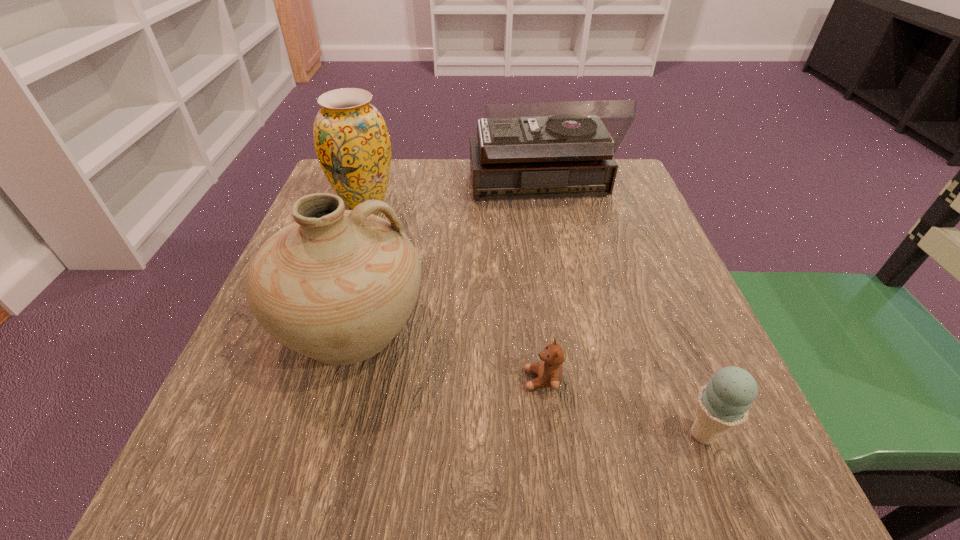
Identify the location of object positioned at the far left corner. This screenshot has height=540, width=960. (351, 140).

Locate an element on the screen. This screenshot has width=960, height=540. object that is at the far right corner is located at coordinates (531, 149).

Locate an element on the screen. This screenshot has height=540, width=960. object that is at the near right corner is located at coordinates (724, 403).

The image size is (960, 540). I want to click on free space at the far edge of the desktop, so click(452, 192).

Where is `vacant space at the near edge of the desktop`? The width and height of the screenshot is (960, 540). vacant space at the near edge of the desktop is located at coordinates (387, 449).

Image resolution: width=960 pixels, height=540 pixels. What are the coordinates of `vacant position at the left edge of the desktop` in the screenshot? It's located at (274, 355).

In the image, there is a desktop. Where is `vacant area at the right edge`? The image size is (960, 540). vacant area at the right edge is located at coordinates (652, 246).

The image size is (960, 540). I want to click on vacant space at the near left corner of the desktop, so click(287, 458).

Find the location of a particular element. The width and height of the screenshot is (960, 540). free area in between the nearest object and the pottery is located at coordinates (527, 380).

The width and height of the screenshot is (960, 540). In order to click on free space between the shortest object and the record player in this screenshot , I will do `click(540, 285)`.